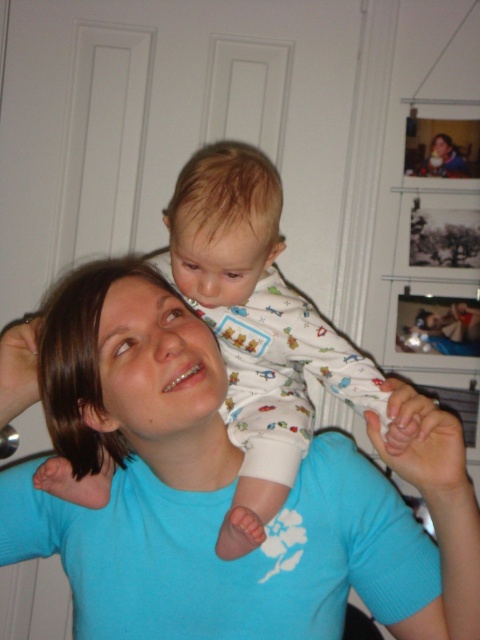
Is blue cotton shirt at center closer to the viewer compared to white cotton onesie at center?

Yes, it is.

Between point (129, 328) and point (242, 285), which one is positioned in front?

Point (129, 328)

Is point (4, 368) more distant than point (247, 262)?

No, it is not.

Identify the location of blue cotton shirt at center. (217, 483).